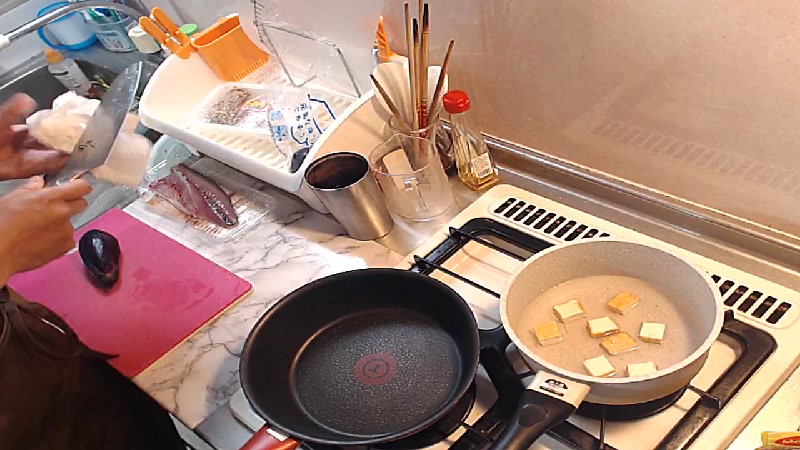
I want to click on chopstick, so click(x=414, y=55).